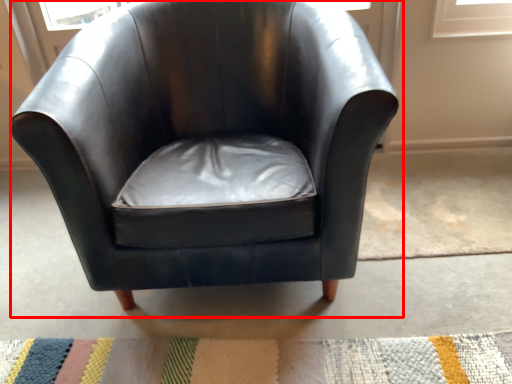
Question: Considering the relative positions of chair (annotated by the red box) and doormat in the image provided, where is chair (annotated by the red box) located with respect to the staircase?

Choices:
 (A) right
 (B) left

Answer: (B)